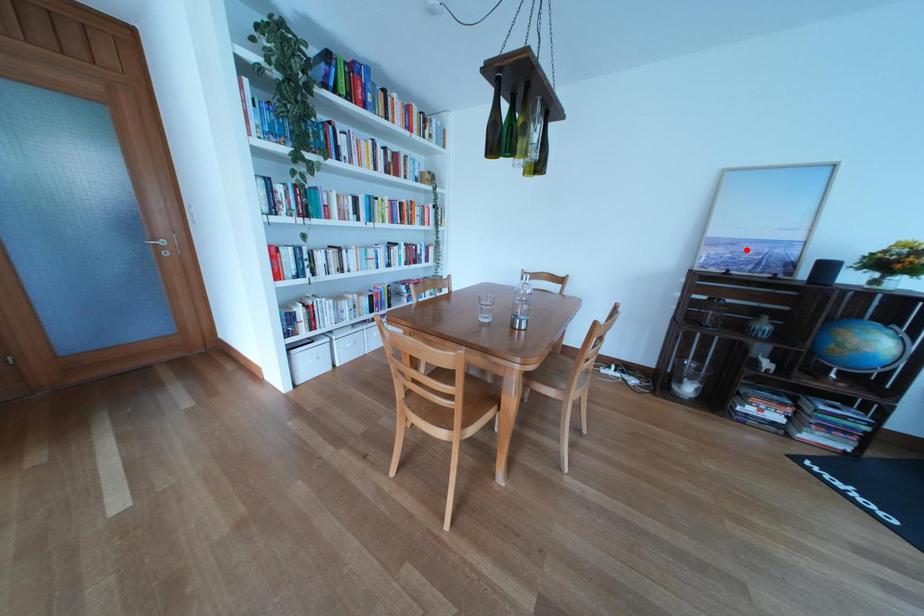
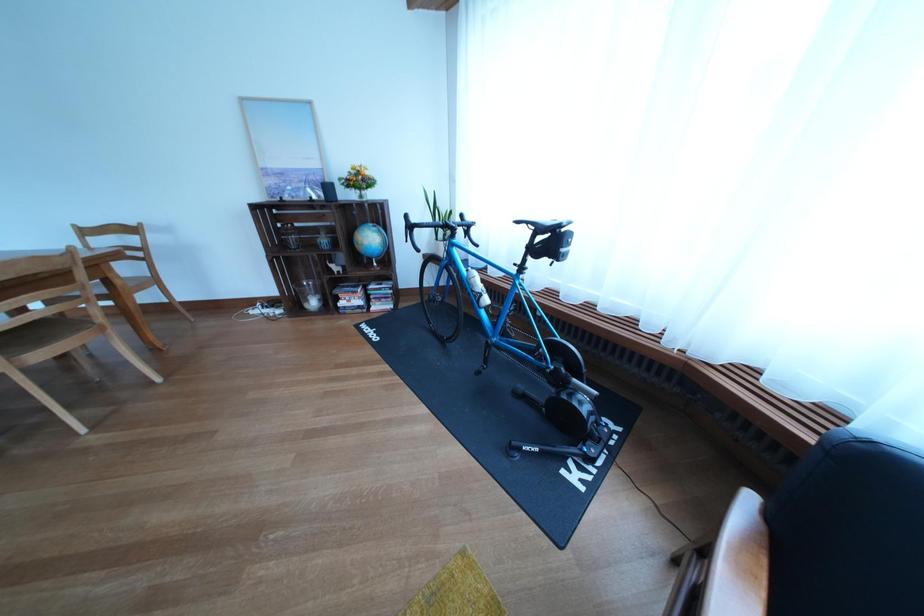
The point at the highlighted location is marked in the first image. Where is the corresponding point in the second image?

(294, 179)